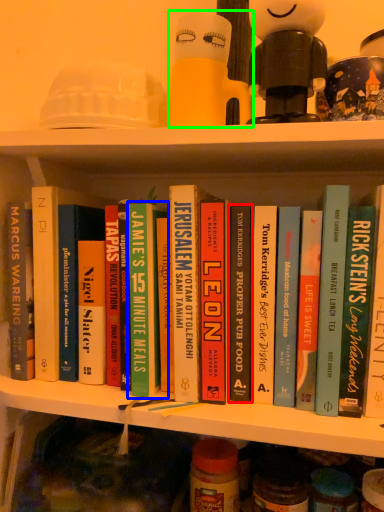
Question: Considering the real-world distances, which object is farthest from book (highlighted by a red box)? book (highlighted by a blue box) or toy (highlighted by a green box)?

Choices:
 (A) book
 (B) toy

Answer: (B)